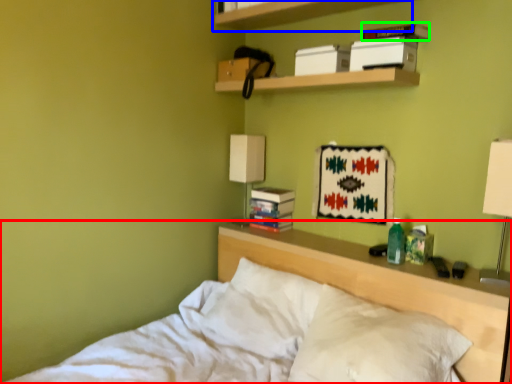
Question: Which object is positioned closest to bed (highlighted by a red box)? Select from shelf (highlighted by a blue box) and paperback book (highlighted by a green box).

Choices:
 (A) shelf
 (B) paperback book

Answer: (B)